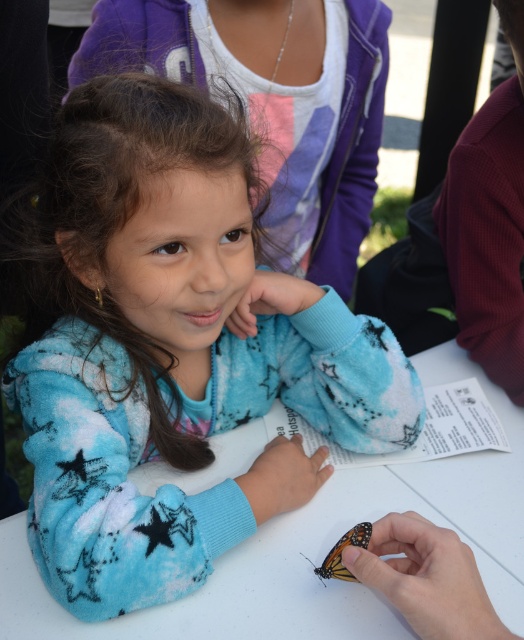
Question: Does blue fuzzy sweater at center have a larger size compared to orange and black winged butterfly at lower center?

Choices:
 (A) yes
 (B) no

Answer: (A)

Question: Based on their relative distances, which object is farther from the orange and black winged butterfly at lower center?

Choices:
 (A) blue fuzzy sweater at center
 (B) white fabric table at center

Answer: (A)

Question: Does blue fuzzy sweater at center have a lesser width compared to white fabric table at center?

Choices:
 (A) no
 (B) yes

Answer: (B)

Question: Based on their relative distances, which object is nearer to the white fabric table at center?

Choices:
 (A) orange and black winged butterfly at lower center
 (B) blue fuzzy sweater at center

Answer: (B)

Question: Which object appears closest to the camera in this image?

Choices:
 (A) blue fuzzy sweater at center
 (B) orange and black winged butterfly at lower center
 (C) white fabric table at center

Answer: (A)

Question: Is blue fuzzy sweater at center thinner than orange and black winged butterfly at lower center?

Choices:
 (A) no
 (B) yes

Answer: (A)